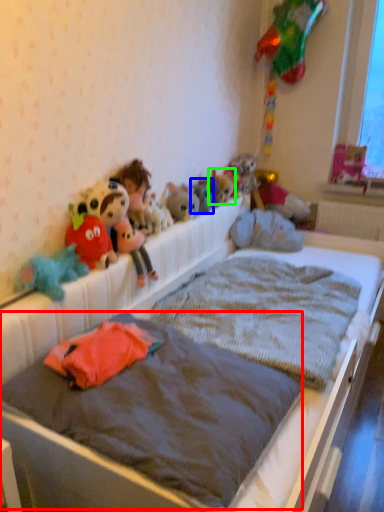
Question: Estimate the real-world distances between objects in this image. Which object is closer to mattress (highlighted by a red box), toy (highlighted by a blue box) or toy (highlighted by a green box)?

Choices:
 (A) toy
 (B) toy

Answer: (A)